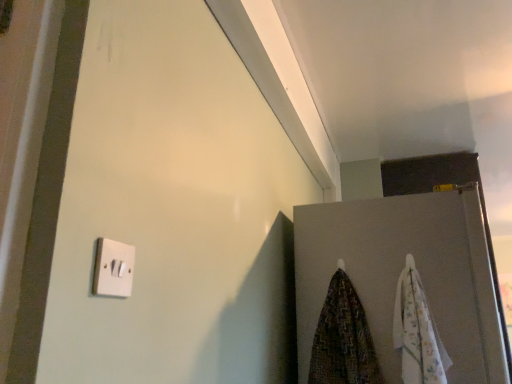
Question: Considering the relative sizes of floral cotton beach towel at right, which appears as the second beach towel when viewed from the left, and white matte door at upper right in the image provided, is floral cotton beach towel at right, which appears as the second beach towel when viewed from the left, wider than white matte door at upper right?

Choices:
 (A) no
 (B) yes

Answer: (A)

Question: Is floral cotton beach towel at right, which is the 1th beach towel from right to left, shorter than white matte door at upper right?

Choices:
 (A) no
 (B) yes

Answer: (B)

Question: Is floral cotton beach towel at right, which is the 1th beach towel from right to left, oriented towards white matte door at upper right?

Choices:
 (A) no
 (B) yes

Answer: (A)

Question: Is white matte door at upper right surrounded by floral cotton beach towel at right, which appears as the second beach towel when viewed from the left?

Choices:
 (A) no
 (B) yes

Answer: (A)

Question: Considering the relative positions of floral cotton beach towel at right, which is the 1th beach towel from right to left, and white matte door at upper right in the image provided, is floral cotton beach towel at right, which is the 1th beach towel from right to left, in front of white matte door at upper right?

Choices:
 (A) no
 (B) yes

Answer: (B)

Question: Is floral cotton beach towel at right, which is the 1th beach towel from right to left, bigger than white matte door at upper right?

Choices:
 (A) no
 (B) yes

Answer: (A)

Question: Does white plastic light switch at lower left have a greater height compared to white matte door at upper right?

Choices:
 (A) no
 (B) yes

Answer: (A)

Question: Considering the relative positions of white plastic light switch at lower left and white matte door at upper right in the image provided, is white plastic light switch at lower left to the left of white matte door at upper right from the viewer's perspective?

Choices:
 (A) no
 (B) yes

Answer: (B)

Question: Is the position of white plastic light switch at lower left more distant than that of white matte door at upper right?

Choices:
 (A) yes
 (B) no

Answer: (B)

Question: Considering the relative sizes of white plastic light switch at lower left and white matte door at upper right in the image provided, is white plastic light switch at lower left thinner than white matte door at upper right?

Choices:
 (A) no
 (B) yes

Answer: (B)

Question: Could you tell me if white plastic light switch at lower left is turned towards white matte door at upper right?

Choices:
 (A) no
 (B) yes

Answer: (A)

Question: Is white plastic light switch at lower left smaller than white matte door at upper right?

Choices:
 (A) yes
 (B) no

Answer: (A)

Question: Is floral cotton beach towel at right, which appears as the second beach towel when viewed from the left, in front of patterned fabric beach towel at lower right, marked as the second beach towel in a right-to-left arrangement?

Choices:
 (A) yes
 (B) no

Answer: (A)